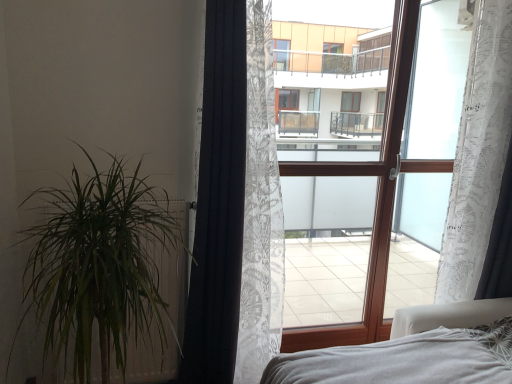
Question: Based on their sizes in the image, would you say white sheer curtain at right is bigger or smaller than white lace curtain at right, which is counted as the 3th curtain, starting from the left?

Choices:
 (A) big
 (B) small

Answer: (A)

Question: In the image, is white sheer curtain at right positioned in front of or behind white lace curtain at right, which is counted as the 3th curtain, starting from the left?

Choices:
 (A) front
 (B) behind

Answer: (B)

Question: Which object is the farthest from the green leafy plant at left?

Choices:
 (A) black textured curtain at left, acting as the 3th curtain starting from the right
 (B) white soft bed at lower right
 (C) white sheer curtain at right
 (D) white lace curtain at right, the 2th curtain in the left-to-right sequence
 (E) transparent fabric at center

Answer: (C)

Question: Considering the real-world distances, which object is farthest from the white lace curtain at right, which is counted as the 3th curtain, starting from the left?

Choices:
 (A) white lace curtain at right, the second curtain in the right-to-left sequence
 (B) white sheer curtain at right
 (C) black textured curtain at left, acting as the 3th curtain starting from the right
 (D) white soft bed at lower right
 (E) transparent fabric at center

Answer: (C)